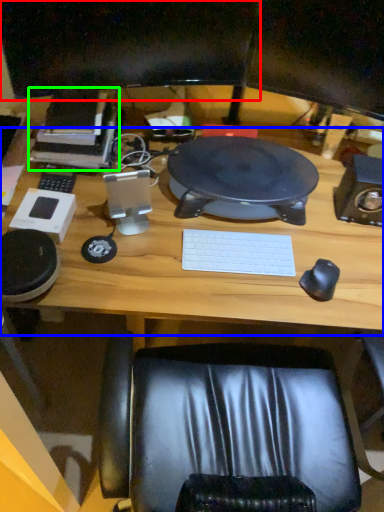
Question: Estimate the real-world distances between objects in this image. Which object is farther from computer monitor (highlighted by a red box), computer desk (highlighted by a blue box) or book (highlighted by a green box)?

Choices:
 (A) computer desk
 (B) book

Answer: (A)